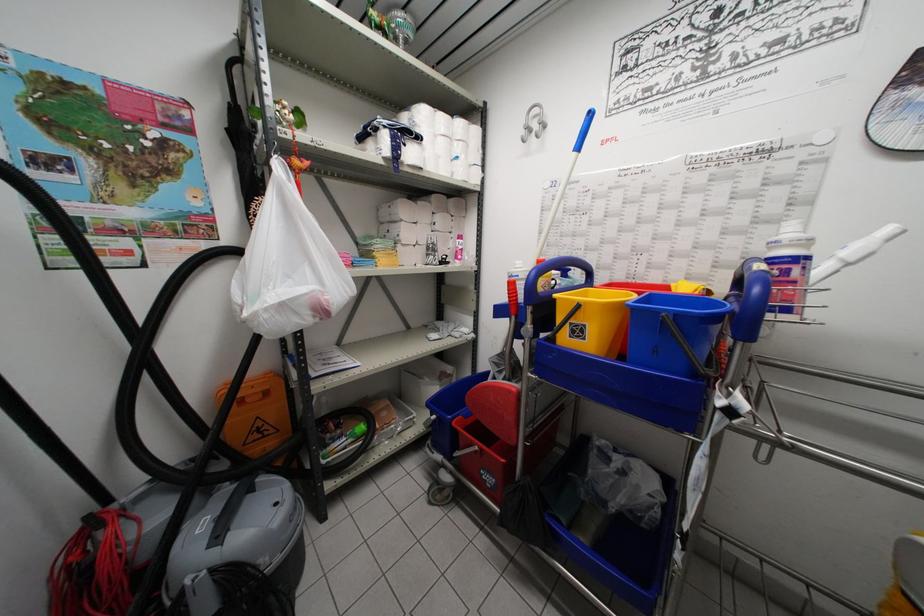
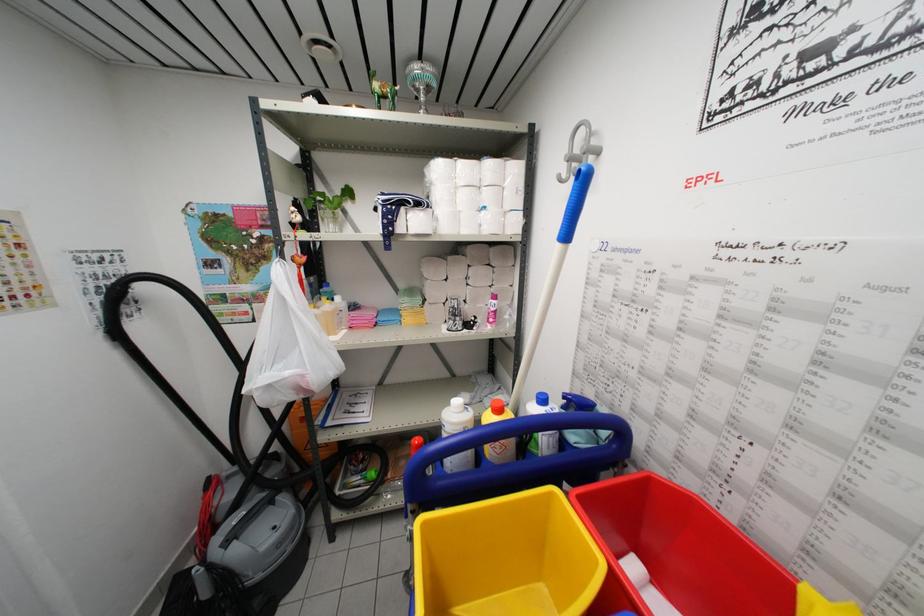
Where in the second image is the point corresponding to (271,310) from the first image?

(258, 392)